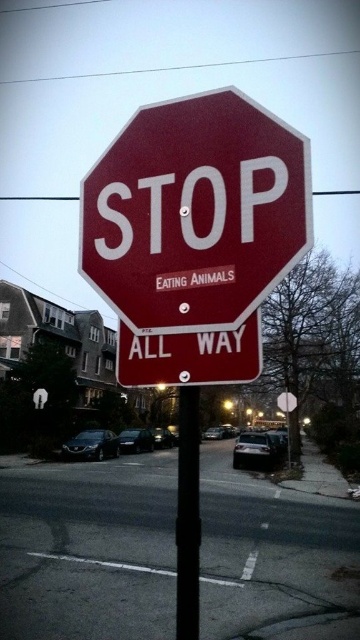
Question: Among these objects, which one is nearest to the camera?

Choices:
 (A) matte red stop sign at center
 (B) red matte sign at center
 (C) black metal pole at center

Answer: (C)

Question: Among these objects, which one is farthest from the camera?

Choices:
 (A) smooth asphalt road at center
 (B) red matte sign at center

Answer: (A)

Question: Is smooth asphalt road at center to the left of black metal pole at center from the viewer's perspective?

Choices:
 (A) no
 (B) yes

Answer: (A)

Question: Where is matte red stop sign at center located in relation to red matte sign at center in the image?

Choices:
 (A) left
 (B) right

Answer: (B)

Question: Is matte red stop sign at center smaller than black metal pole at center?

Choices:
 (A) yes
 (B) no

Answer: (A)

Question: Which of these objects is positioned farthest from the smooth asphalt road at center?

Choices:
 (A) black metal pole at center
 (B) red matte sign at center
 (C) matte red stop sign at center

Answer: (B)